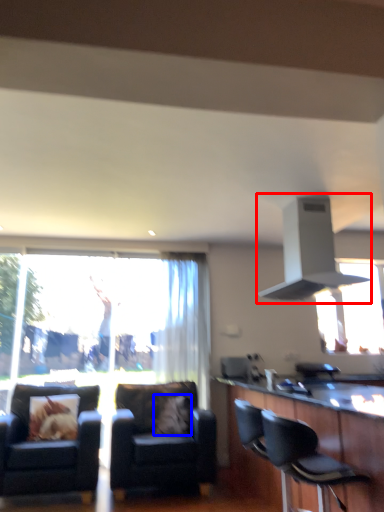
Question: Which object appears farthest to the camera in this image, exhaust hood (highlighted by a red box) or pillow (highlighted by a blue box)?

Choices:
 (A) exhaust hood
 (B) pillow

Answer: (B)